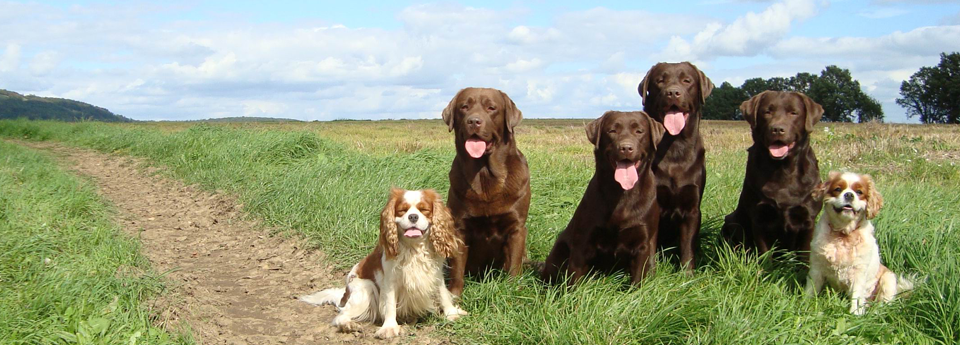
This screenshot has height=345, width=960. Find the location of `left front leg`. left front leg is located at coordinates (445, 291), (516, 241), (643, 251), (690, 228), (856, 292).